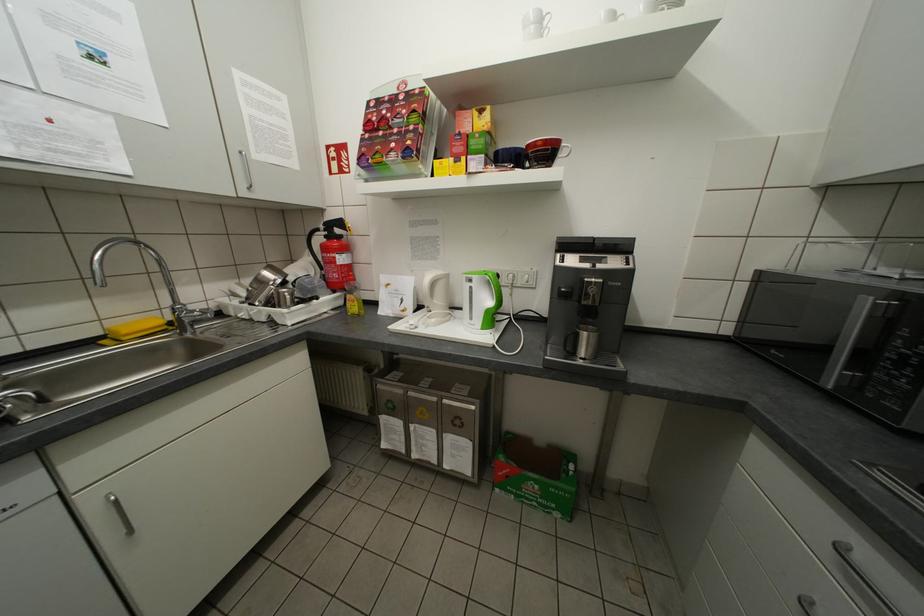
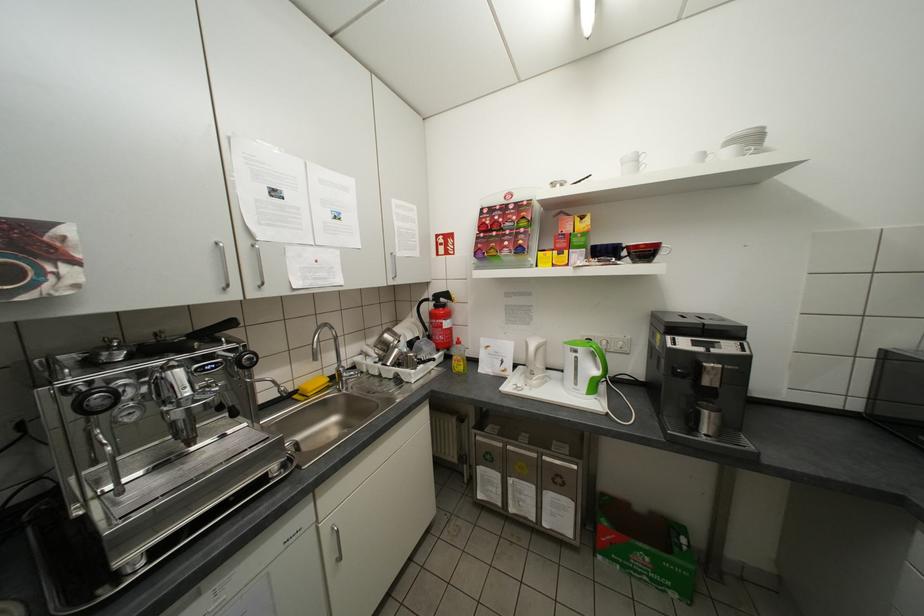
In the second image, find the point that corresponds to point 334,237 in the first image.

(444, 306)